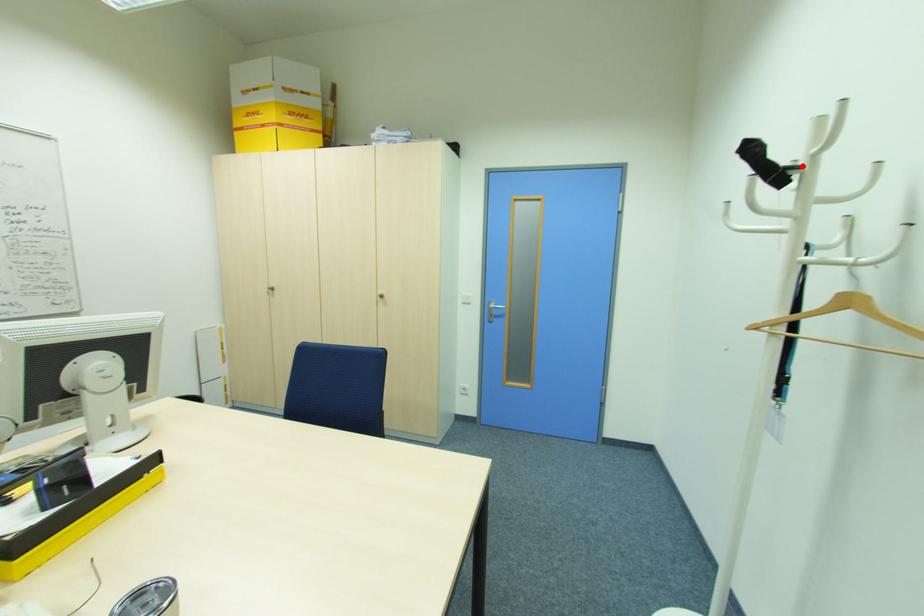
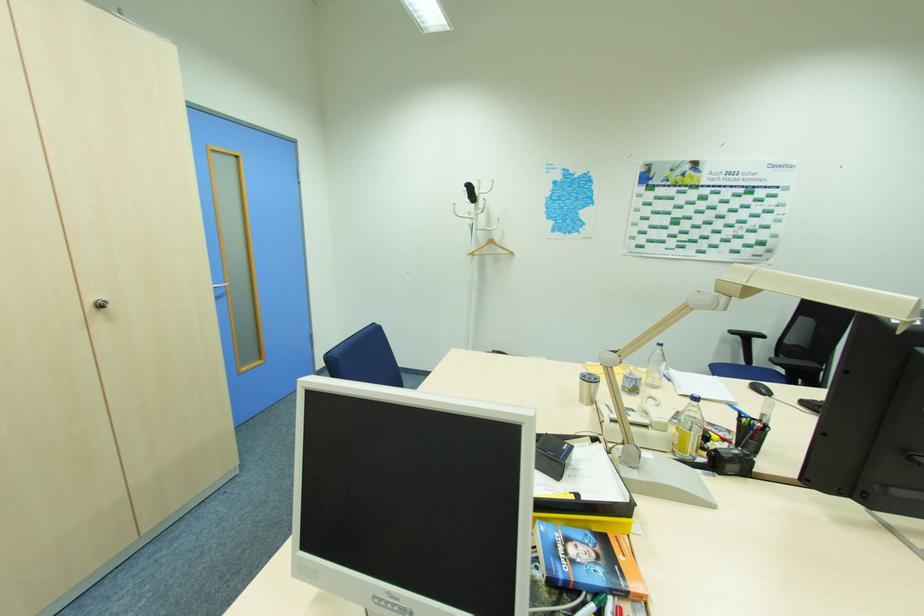
In the second image, find the point that corresponds to the highlighted location in the first image.

(479, 197)